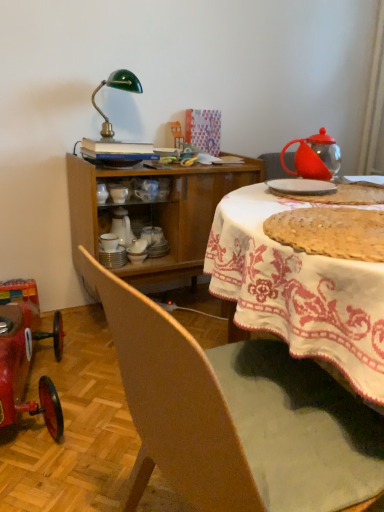
Question: In terms of height, does wooden cabinet at center look taller or shorter compared to golden crumbly pie at center?

Choices:
 (A) tall
 (B) short

Answer: (A)

Question: Which is correct: wooden cabinet at center is inside golden crumbly pie at center, or outside of it?

Choices:
 (A) inside
 (B) outside

Answer: (B)

Question: Considering the real-world distances, which object is farthest from the white ceramic plates at center, positioned as the 2th tableware in back-to-front order?

Choices:
 (A) wooden cabinet at center
 (B) golden crumbly pie at center
 (C) porcelain cup at center, the second tableware when ordered from right to left
 (D) wooden chair at lower left
 (E) green glass lamp at upper left

Answer: (D)

Question: Estimate the real-world distances between objects in this image. Which object is farther from the shiny red toy car at lower left?

Choices:
 (A) green glass lamp at upper left
 (B) wooden chair at lower left
 (C) golden crumbly pie at center
 (D) porcelain cup at center, which is the 3th tableware in back-to-front order
 (E) transparent glass teapot at upper right

Answer: (E)